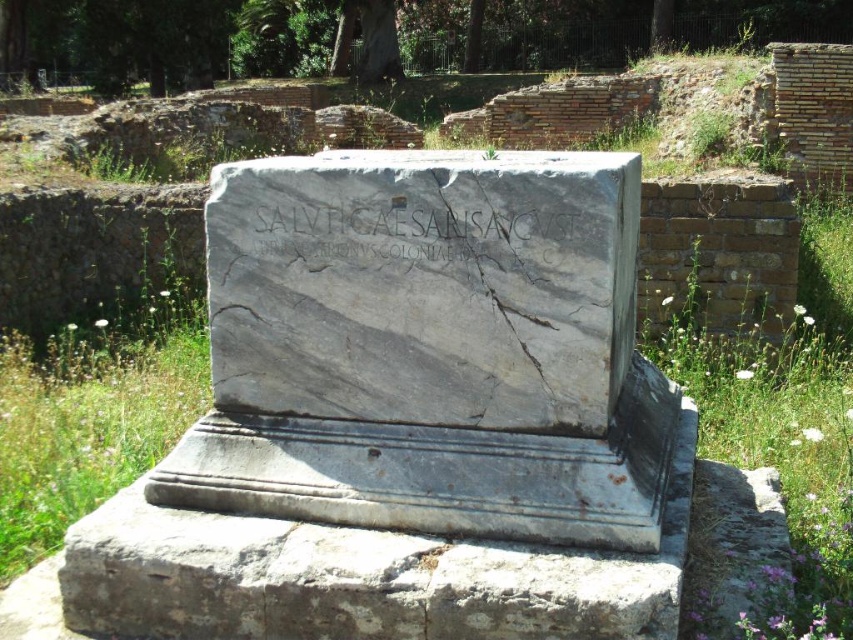
Is gray marble stone at center thinner than gray marble inscription at center?

No, gray marble stone at center is not thinner than gray marble inscription at center.

Is gray marble stone at center shorter than gray marble inscription at center?

No, gray marble stone at center is not shorter than gray marble inscription at center.

Which is in front, point (311, 212) or point (312, 240)?

Positioned in front is point (311, 212).

You are a GUI agent. You are given a task and a screenshot of the screen. Output one action in this format:
    pyautogui.click(x=<x>, y=<y>)
    Task: Click on the gray marble stone at center
    The width and height of the screenshot is (853, 640).
    Given the screenshot: What is the action you would take?
    pyautogui.click(x=428, y=348)